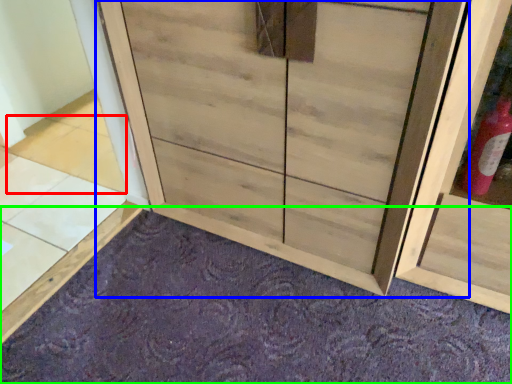
Question: Estimate the real-world distances between objects in this image. Which object is closer to tile (highlighted by a red box), cupboard (highlighted by a blue box) or plain (highlighted by a green box)?

Choices:
 (A) cupboard
 (B) plain

Answer: (A)